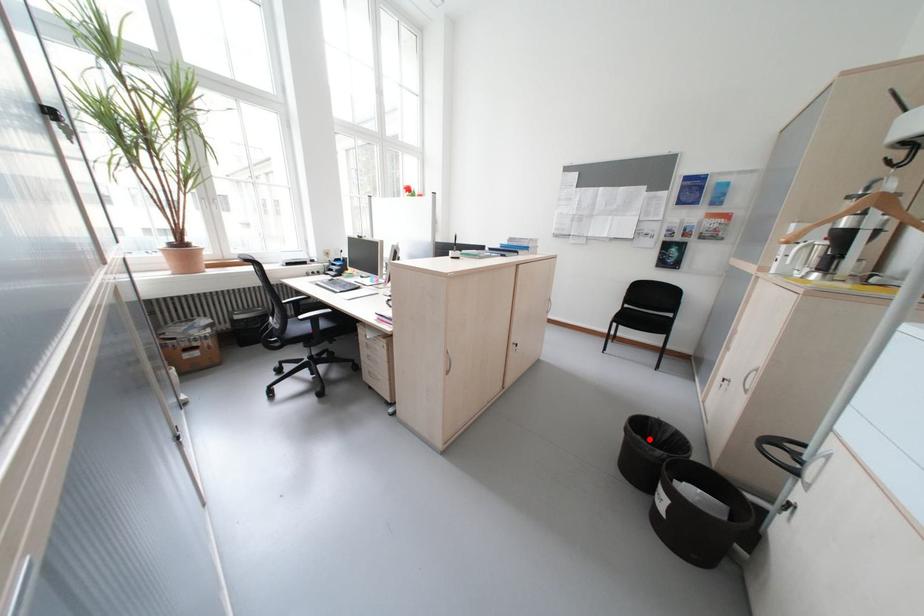
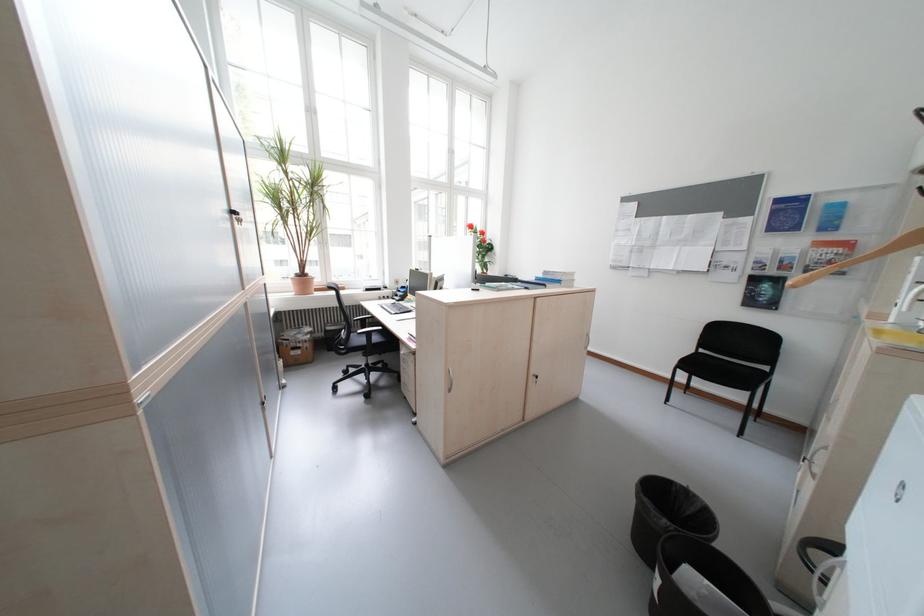
In the second image, find the point that corresponds to the highlighted location in the first image.

(655, 501)